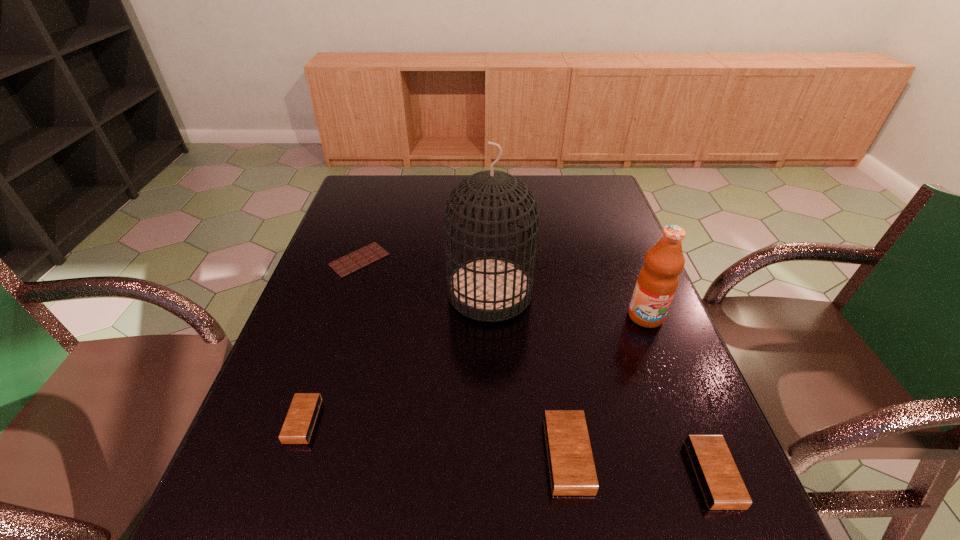
Find the location of a particular element. The width and height of the screenshot is (960, 540). free region located on the front face of the second alarm clock from right to left is located at coordinates (614, 456).

What are the coordinates of `vacant space situated 0.100m on the front label of the second tallest object` in the screenshot? It's located at (663, 363).

This screenshot has width=960, height=540. Identify the location of blank space located on the left of the tallest object. (311, 292).

What are the coordinates of `free spot located 0.060m on the right of the shortest object` in the screenshot? It's located at (409, 260).

Identify the location of alarm clock situated at the left edge. click(297, 429).

Locate an element on the screen. chocolate bar at the left edge is located at coordinates click(x=373, y=252).

Find the location of `alarm clock situated at the right edge`. alarm clock situated at the right edge is located at coordinates (722, 486).

This screenshot has width=960, height=540. Identify the location of fruit juice at the right edge. (658, 279).

At what (x,y) coordinates should I click in order to perform the action: click on object that is at the near left corner. Please return your answer as a coordinate pair (x, y). This screenshot has height=540, width=960. Looking at the image, I should click on (297, 429).

Identify the location of object that is at the near right corner. The image size is (960, 540). (722, 486).